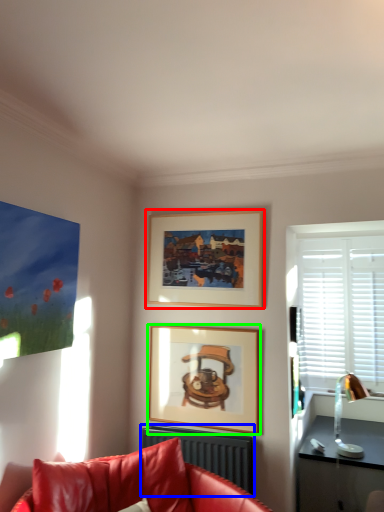
Question: Based on their relative distances, which object is farther from picture frame (highlighted by a red box)? Choose from radiator (highlighted by a blue box) and picture frame (highlighted by a green box).

Choices:
 (A) radiator
 (B) picture frame

Answer: (A)